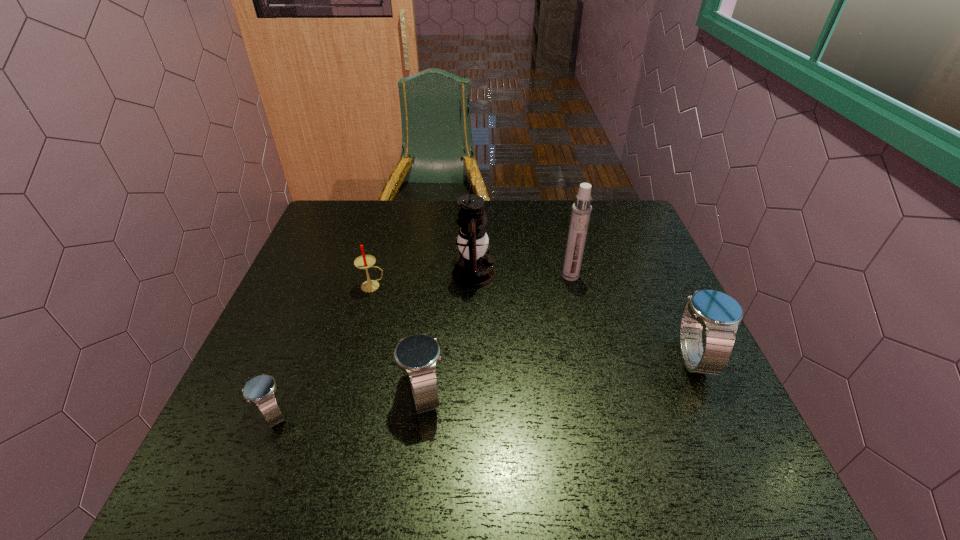
To make them evenly spaced by inserting another watch among them, please locate a free space for this new watch. Please provide its 2D coordinates. Your answer should be formatted as a tuple, i.e. [(x, y)], where the tuple contains the x and y coordinates of a point satisfying the conditions above.

[(564, 375)]